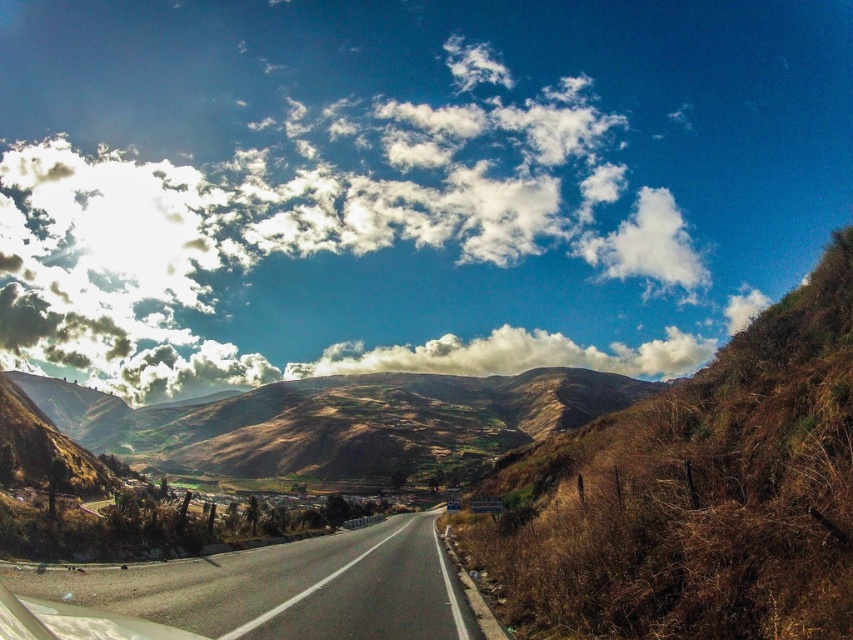
Question: Estimate the real-world distances between objects in this image. Which object is farther from the brown textured hillside at center?

Choices:
 (A) asphalt road at center
 (B) grassy dirt path at lower right
 (C) cloudy sky at upper center

Answer: (B)

Question: Can you confirm if brown grassy hill at right is positioned below grassy dirt path at lower right?

Choices:
 (A) yes
 (B) no

Answer: (B)

Question: Based on their relative distances, which object is farther from the grassy dirt path at lower right?

Choices:
 (A) cloudy sky at upper center
 (B) brown grassy hill at right

Answer: (A)

Question: Based on their relative distances, which object is nearer to the cloudy sky at upper center?

Choices:
 (A) grassy dirt path at lower right
 (B) asphalt road at center

Answer: (B)

Question: Is cloudy sky at upper center above asphalt road at center?

Choices:
 (A) yes
 (B) no

Answer: (A)

Question: Does cloudy sky at upper center have a smaller size compared to brown textured hillside at center?

Choices:
 (A) no
 (B) yes

Answer: (A)